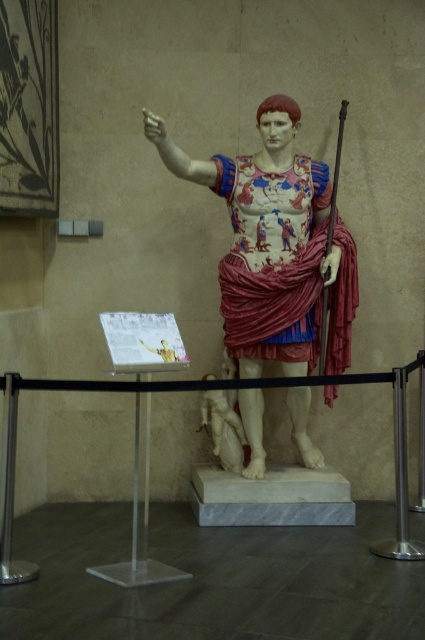
Question: Is marble statue at center to the right of marble statue of a figure at center from the viewer's perspective?

Choices:
 (A) no
 (B) yes

Answer: (B)

Question: Which point is farther to the camera?

Choices:
 (A) marble statue at center
 (B) marble statue of a figure at center

Answer: (B)

Question: Which of the following is the farthest from the observer?

Choices:
 (A) marble statue of a figure at center
 (B) marble statue at center

Answer: (A)

Question: Is marble statue at center closer to camera compared to marble statue of a figure at center?

Choices:
 (A) no
 (B) yes

Answer: (B)

Question: Does marble statue at center appear under marble statue of a figure at center?

Choices:
 (A) yes
 (B) no

Answer: (B)